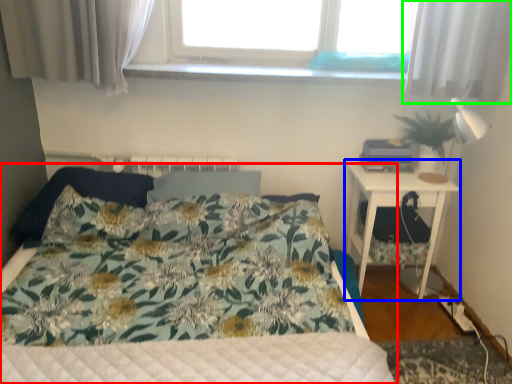
Question: Based on their relative distances, which object is farther from bed (highlighted by a red box)? Choose from nightstand (highlighted by a blue box) and curtain (highlighted by a green box).

Choices:
 (A) nightstand
 (B) curtain

Answer: (B)